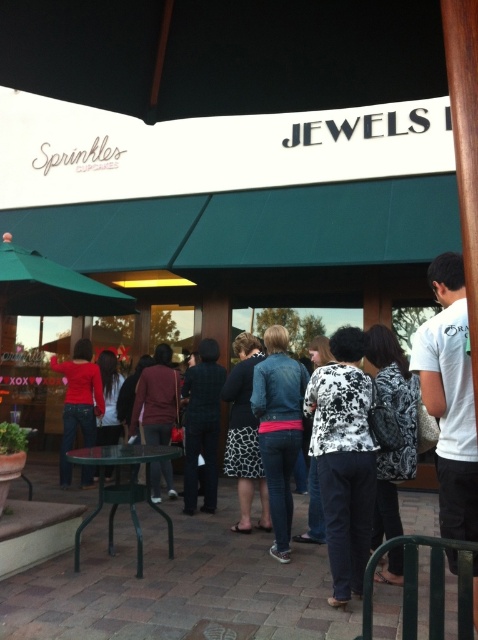
You are a delivery person who needs to place a package on the green metal table at lower left. However, there is a maroon sweater at center in the way. Can you place the package on the table without moving the sweater?

The green metal table at lower left is shorter than the maroon sweater at center, so the sweater is taller than the table. This means the sweater is blocking the table, making it impossible to place the package on the table without moving the sweater.

You are a photographer standing at the camera position. You want to place a small tripod on the green metal table at lower left to take a photo. Is the distance from your current position to the table sufficient to allow you to set up the tripod without moving closer?

The green metal table at lower left is 3.46 meters from camera, so yes, the distance is sufficient to set up the tripod without moving closer.

You are a photographer trying to capture a candid shot of the denim jacket at center without getting too close. Your camera has a maximum zoom range of 5 meters. Can you take the photo from your current position?

The denim jacket at center and camera are 3.96 meters apart, so yes, the photographer can take the photo from their current position since the distance is within the camera maximum zoom range of 5 meters.